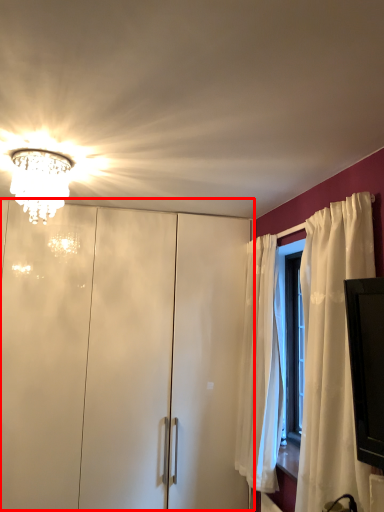
Question: From the image, what is the correct spatial relationship of dresser (annotated by the red box) in relation to lamp?

Choices:
 (A) right
 (B) left

Answer: (A)